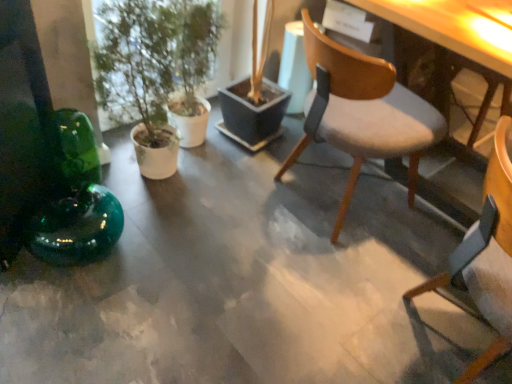
Question: From a real-world perspective, is light gray fabric chair at center, which is the 2th chair from front to back, positioned over green matte plant at left based on gravity?

Choices:
 (A) yes
 (B) no

Answer: (B)

Question: From the image's perspective, is light gray fabric chair at center, the first chair in the back-to-front sequence, under green matte plant at left?

Choices:
 (A) yes
 (B) no

Answer: (A)

Question: Does light gray fabric chair at center, the first chair in the back-to-front sequence, touch green matte plant at left?

Choices:
 (A) yes
 (B) no

Answer: (B)

Question: Is light gray fabric chair at center, which is the 2th chair from front to back, thinner than green matte plant at left?

Choices:
 (A) yes
 (B) no

Answer: (B)

Question: Does light gray fabric chair at center, the first chair in the back-to-front sequence, come in front of green matte plant at left?

Choices:
 (A) no
 (B) yes

Answer: (B)

Question: Does point (361, 127) appear closer or farther from the camera than point (134, 66)?

Choices:
 (A) farther
 (B) closer

Answer: (A)

Question: From a real-world perspective, is light gray fabric chair at center, which is the 2th chair from front to back, above or below green matte plant at left?

Choices:
 (A) below
 (B) above

Answer: (A)

Question: Based on their positions, is light gray fabric chair at center, the first chair in the back-to-front sequence, located to the left or right of green matte plant at left?

Choices:
 (A) left
 (B) right

Answer: (B)

Question: Relative to green matte plant at left, is light gray fabric chair at center, which is the 2th chair from front to back, in front or behind?

Choices:
 (A) front
 (B) behind

Answer: (A)

Question: Relative to wooden chair at center, which is the second chair in back-to-front order, is light gray fabric chair at center, which is the 2th chair from front to back, in front or behind?

Choices:
 (A) front
 (B) behind

Answer: (B)

Question: From a real-world perspective, is light gray fabric chair at center, which is the 2th chair from front to back, physically located above or below wooden chair at center, the first chair when ordered from front to back?

Choices:
 (A) below
 (B) above

Answer: (A)

Question: Is point (434, 115) closer or farther from the camera than point (458, 253)?

Choices:
 (A) farther
 (B) closer

Answer: (A)

Question: Looking at the image, does light gray fabric chair at center, which is the 2th chair from front to back, seem bigger or smaller compared to wooden chair at center, which is the second chair in back-to-front order?

Choices:
 (A) big
 (B) small

Answer: (A)

Question: From the image's perspective, is green matte plant at left above or below light gray fabric chair at center, which is the 2th chair from front to back?

Choices:
 (A) above
 (B) below

Answer: (A)

Question: In terms of size, does green matte plant at left appear bigger or smaller than light gray fabric chair at center, which is the 2th chair from front to back?

Choices:
 (A) big
 (B) small

Answer: (B)